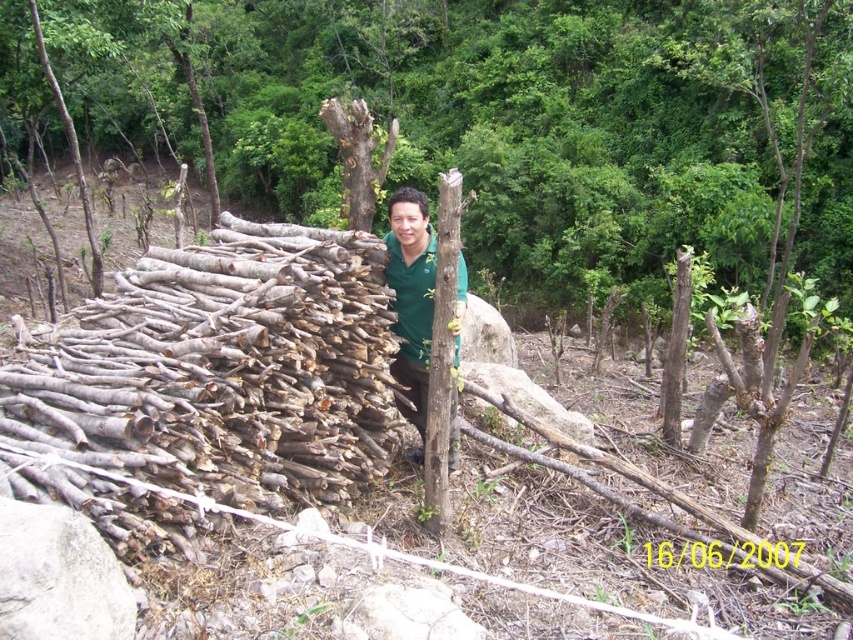
You are a safety inspector assessing the site. You notice the brown rough wood at center and the green matte shirt at center. Which object would you prioritize checking for potential safety hazards, and why?

The brown rough wood at center should be prioritized for safety checks because it is larger in size than the green matte shirt at center, making it more likely to pose a risk of injury or obstruction.

You are a construction worker who needs to access the green matte shirt at center. The bark textured tree at center is blocking your path. Can you move the tree to reach the shirt?

The bark textured tree at center is positioned over the green matte shirt at center, so you cannot reach the shirt without moving the tree first.